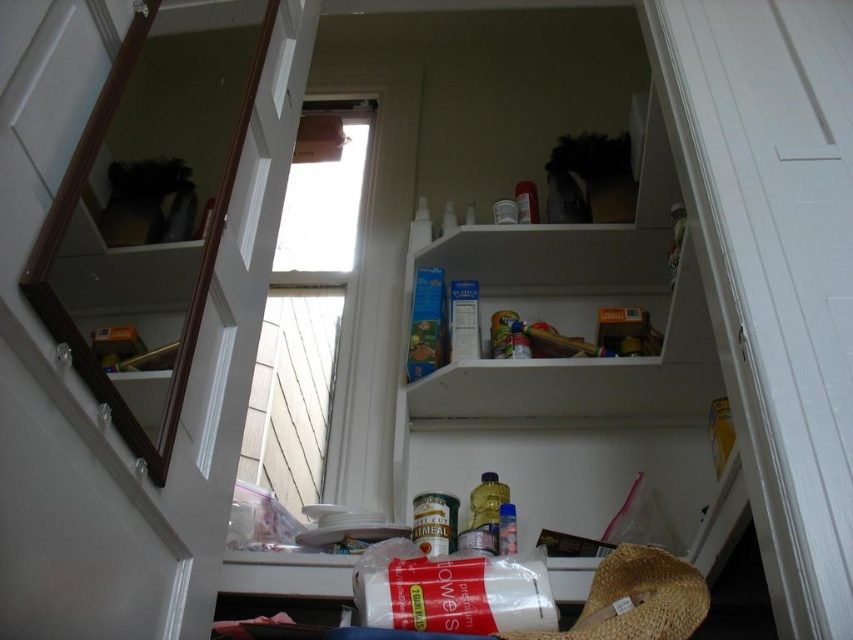
You are a delivery person who just arrived at a home to drop off a large box. You see the white matte shelf at upper center marked by point [573,326]. Can you place the box on this shelf without exceeding its height?

The white matte shelf at upper center is represented by point [573,326]. However, the height of the shelf isn not provided in the description, so it is impossible to determine if the box will fit.

You are standing in the storage area and want to reach both points. Which point, point (496, 272) or point (654, 602), is closer to you?

Point (496, 272) is closer to you because it is further to the camera than point (654, 602).

You are organizing the pantry and need to place the brown woven straw hat at lower right onto the white matte shelf at upper center. Can you do this without moving any other items?

The white matte shelf at upper center is above the brown woven straw hat at lower right, so you can place the hat on the shelf by lifting it upwards since the shelf is positioned higher than the hat.